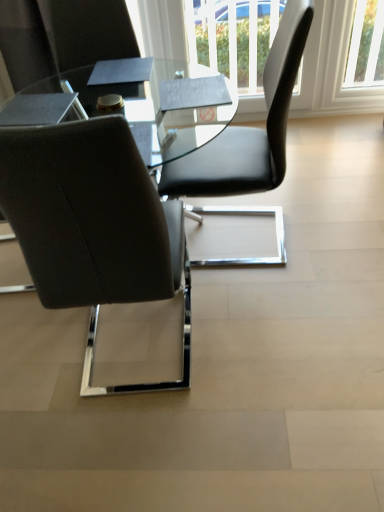
You are a GUI agent. You are given a task and a screenshot of the screen. Output one action in this format:
    pyautogui.click(x=<x>, y=<y>)
    Task: Click on the free point to the right of black leather chair at upper right, acting as the 2th chair starting from the left
    
    Given the screenshot: What is the action you would take?
    pyautogui.click(x=325, y=226)